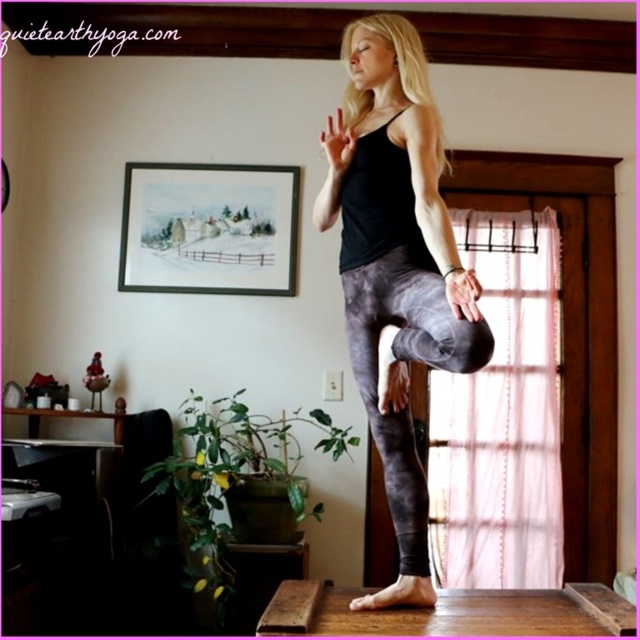
You are a fashion designer observing a yoga practitioner wearing the black matte tank top at center and gray marbled leggings at center. Which clothing item has a greater width?

The black matte tank top at center has a greater width than the gray marbled leggings at center according to the description.

You are a fashion designer observing the person practicing yoga. You need to determine which clothing item is longer in length between the black matte tank top at center and the gray marbled leggings at center. Which one is longer?

The black matte tank top at center has a greater height compared to the gray marbled leggings at center, so the black matte tank top at center is longer in length.